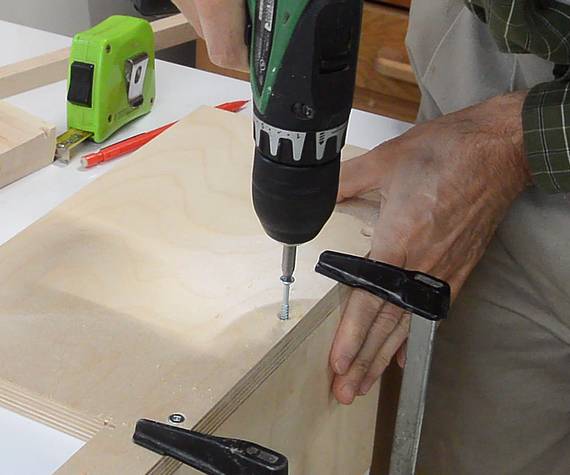
Locate an element on the screen. The height and width of the screenshot is (475, 570). corner of light grey wall is located at coordinates (89, 12).